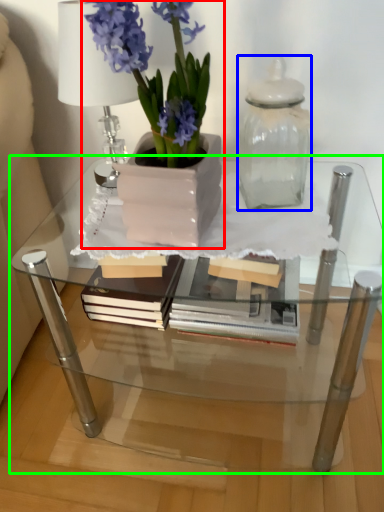
Question: Considering the real-world distances, which object is farthest from houseplant (highlighted by a red box)? glass vase (highlighted by a blue box) or table (highlighted by a green box)?

Choices:
 (A) glass vase
 (B) table

Answer: (B)